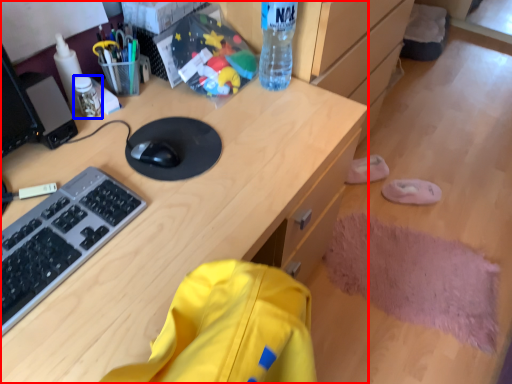
Question: Which object appears closest to the camera in this image, desk (highlighted by a red box) or stationery (highlighted by a blue box)?

Choices:
 (A) desk
 (B) stationery

Answer: (A)